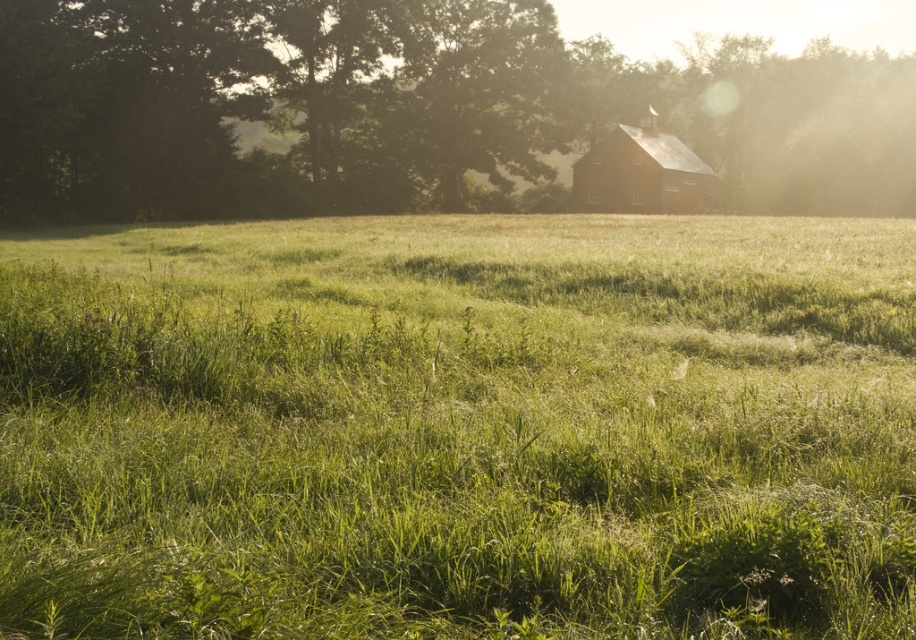
You are standing in the middle of the green grassy pasture at center and want to walk to the matte red barn at center. Which direction should you head to reach the barn?

Since the green grassy pasture at center is closer to the viewer than the matte red barn at center, you should head towards the direction away from the viewer to reach the matte red barn at center.

You are standing in the middle of the green grassy pasture at center and want to look up at the green leafy tree at upper center. In which direction should you look?

You should look upward because the green grassy pasture at center is below the green leafy tree at upper center.